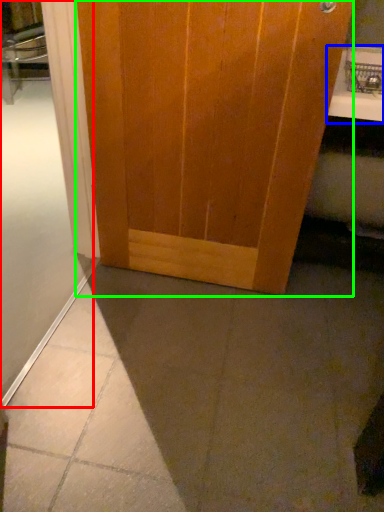
Question: Which object is the farthest from shower door (highlighted by a red box)? Choose among these: counter top (highlighted by a blue box) or door (highlighted by a green box).

Choices:
 (A) counter top
 (B) door

Answer: (A)